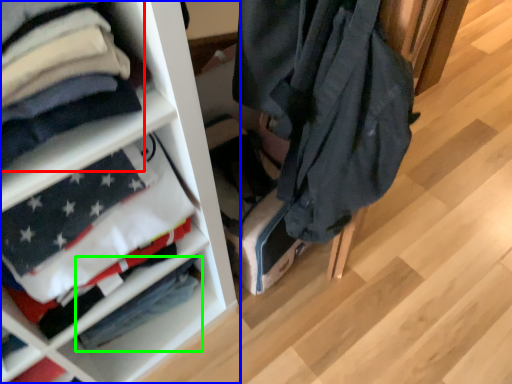
Question: Which object is the closest to the cloak (highlighted by a red box)? Choose among these: shelf (highlighted by a blue box) or flag (highlighted by a green box).

Choices:
 (A) shelf
 (B) flag

Answer: (A)